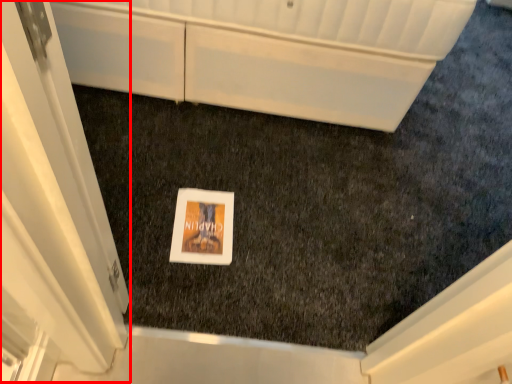
Question: From the image's perspective, considering the relative positions of screen door (annotated by the red box) and cabinetry in the image provided, where is screen door (annotated by the red box) located with respect to the staircase?

Choices:
 (A) below
 (B) above

Answer: (A)